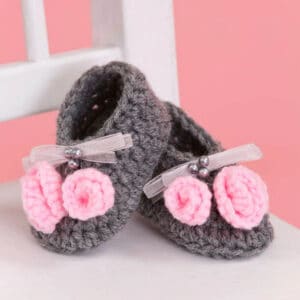
At what (x,y) coordinates should I click in order to perform the action: click on silver decorative balls. Please return your answer as a coordinate pair (x, y). This screenshot has width=300, height=300. Looking at the image, I should click on (77, 153).